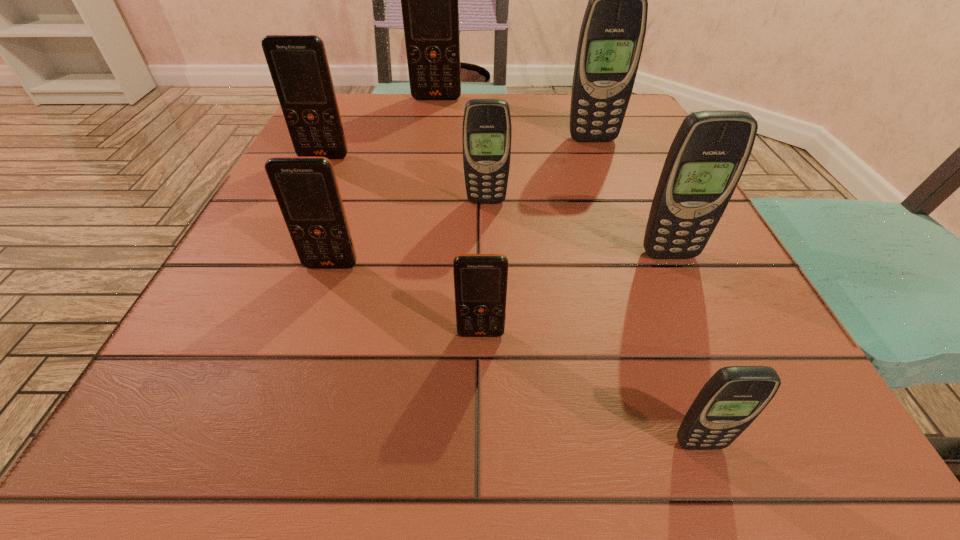
At what (x,y) coordinates should I click in order to perform the action: click on unoccupied position between the fourth nearest object and the nearest gray cellular telephone. Please return your answer as a coordinate pair (x, y). Looking at the image, I should click on (684, 349).

Identify the location of the sixth closest object relative to the nearest gray cellular telephone. The height and width of the screenshot is (540, 960). (298, 64).

Identify which object is located as the sixth nearest to the sixth nearest cellular telephone. Please provide its 2D coordinates. Your answer should be formatted as a tuple, i.e. [(x, y)], where the tuple contains the x and y coordinates of a point satisfying the conditions above.

[(709, 153)]

Select which cellular telephone appears as the third closest to the third nearest orange cellular telephone. Please provide its 2D coordinates. Your answer should be formatted as a tuple, i.e. [(x, y)], where the tuple contains the x and y coordinates of a point satisfying the conditions above.

[(306, 189)]

Find the location of a particular element. cellular telephone that is the sixth nearest to the sixth nearest object is located at coordinates (709, 153).

The height and width of the screenshot is (540, 960). What are the coordinates of `orange cellular telephone that can be found as the second closest to the seventh nearest cellular telephone` in the screenshot? It's located at (298, 64).

Choose which orange cellular telephone is the nearest neighbor to the biggest gray cellular telephone. Please provide its 2D coordinates. Your answer should be formatted as a tuple, i.e. [(x, y)], where the tuple contains the x and y coordinates of a point satisfying the conditions above.

[(429, 0)]

Image resolution: width=960 pixels, height=540 pixels. What are the coordinates of `gray cellular telephone that can be found as the closest to the seventh nearest cellular telephone` in the screenshot? It's located at (487, 130).

Find the location of a particular element. This screenshot has height=540, width=960. gray cellular telephone that stands as the fourth closest to the third nearest cellular telephone is located at coordinates (612, 34).